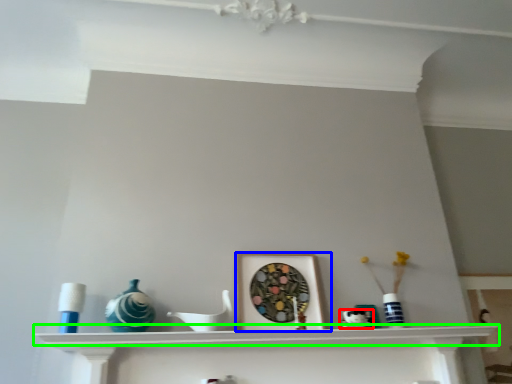
Question: Estimate the real-world distances between objects in this image. Which object is closer to art (highlighted by a red box), picture frame (highlighted by a blue box) or shelf (highlighted by a green box)?

Choices:
 (A) picture frame
 (B) shelf

Answer: (A)